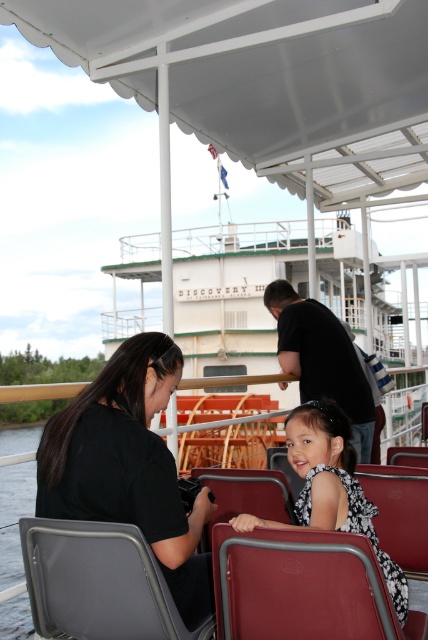
Question: Among these objects, which one is nearest to the camera?

Choices:
 (A) gray fabric chair at lower left
 (B) leather-like red chair at lower center

Answer: (B)

Question: Does black matte shirt at left have a lesser width compared to leather-like red chair at lower center?

Choices:
 (A) no
 (B) yes

Answer: (A)

Question: Is black matte shirt at left smaller than gray fabric chair at lower left?

Choices:
 (A) yes
 (B) no

Answer: (B)

Question: Estimate the real-world distances between objects in this image. Which object is closer to the gray fabric chair at lower left?

Choices:
 (A) black matte shirt at left
 (B) white printed dress at center
 (C) leather-like red chair at lower center

Answer: (A)

Question: Which point is farther to the camera?

Choices:
 (A) black matte shirt at left
 (B) leather-like red chair at lower center

Answer: (A)

Question: Does black matte shirt at left have a smaller size compared to gray fabric chair at lower left?

Choices:
 (A) yes
 (B) no

Answer: (B)